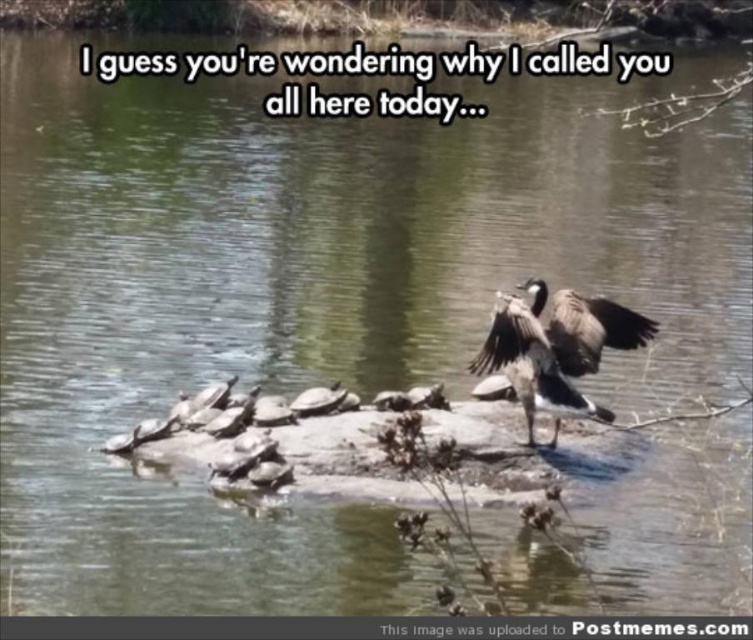
Question: Where is gray feathered goose at center located in relation to matte gray wing at upper right in the image?

Choices:
 (A) below
 (B) above

Answer: (A)

Question: Does gray feathered goose at center have a smaller size compared to matte gray wing at upper right?

Choices:
 (A) yes
 (B) no

Answer: (B)

Question: Can you confirm if gray feathered goose at center is wider than matte gray wing at upper right?

Choices:
 (A) no
 (B) yes

Answer: (B)